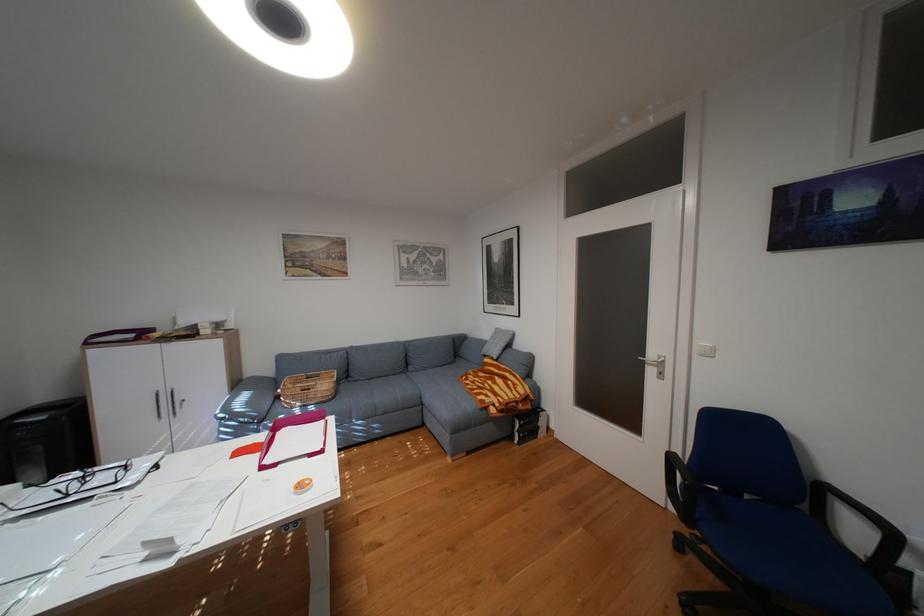
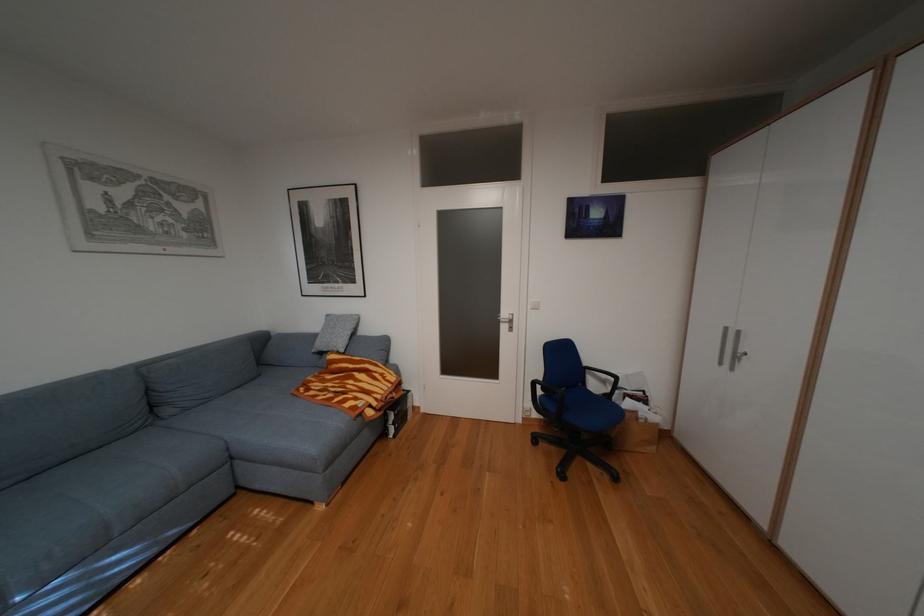
Find the pixel in the second image that matches (x=684, y=456) in the first image.

(545, 383)